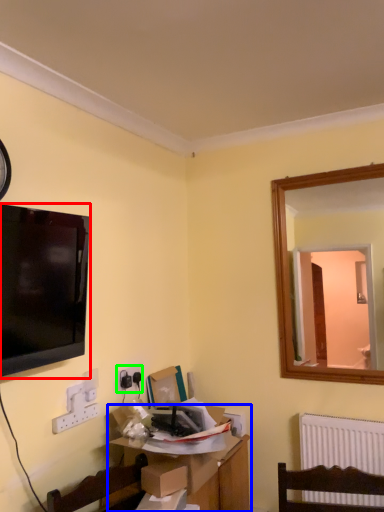
Question: Which object is positioned closest to television (highlighted by a red box)? Select from table (highlighted by a blue box) and electric outlet (highlighted by a green box).

Choices:
 (A) table
 (B) electric outlet

Answer: (B)